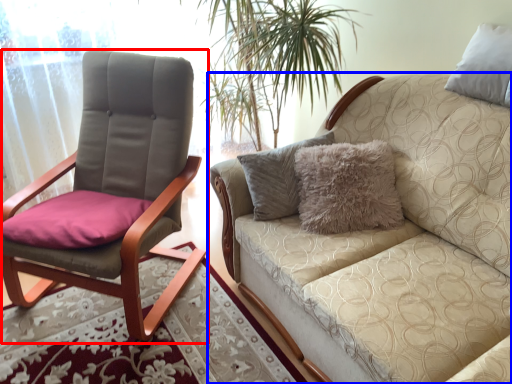
Question: Which of the following is the closest to the observer, chair (highlighted by a red box) or studio couch (highlighted by a blue box)?

Choices:
 (A) chair
 (B) studio couch

Answer: (B)